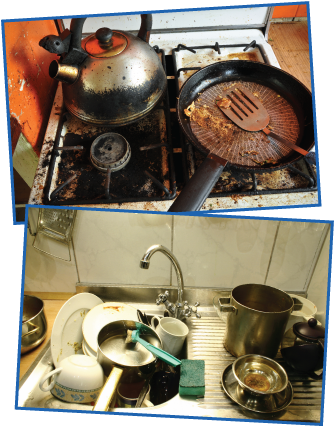
Identify the location of dog bowl next to sink. This screenshot has width=335, height=427. (262, 380).